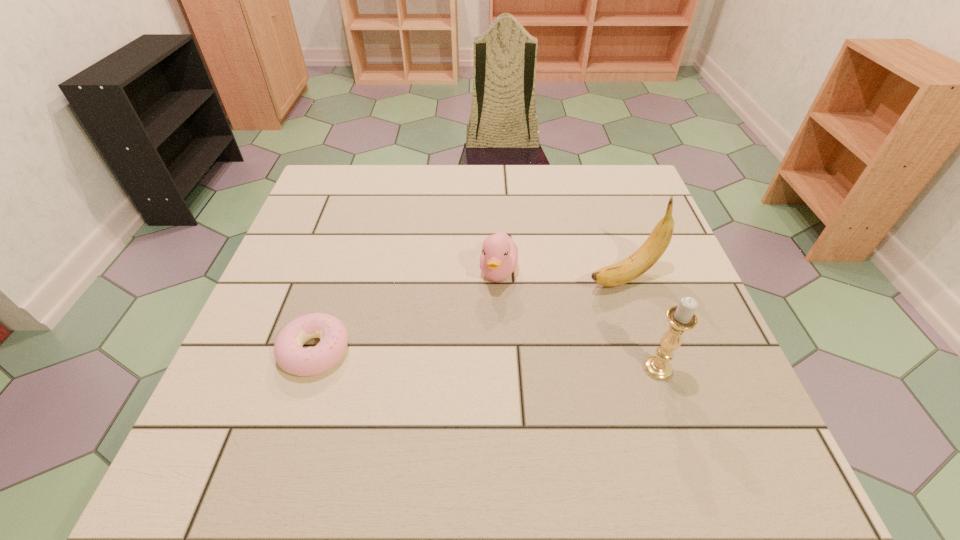
Locate an element on the screen. This screenshot has width=960, height=540. vacant spot on the desktop that is between the shortest object and the candle holder and is positioned at the start of the peel on the banana is located at coordinates (442, 357).

The width and height of the screenshot is (960, 540). Find the location of `free space on the desktop that is between the leftmost object and the candle holder and is positioned on the front-facing side of the second shortest object`. free space on the desktop that is between the leftmost object and the candle holder and is positioned on the front-facing side of the second shortest object is located at coordinates (487, 359).